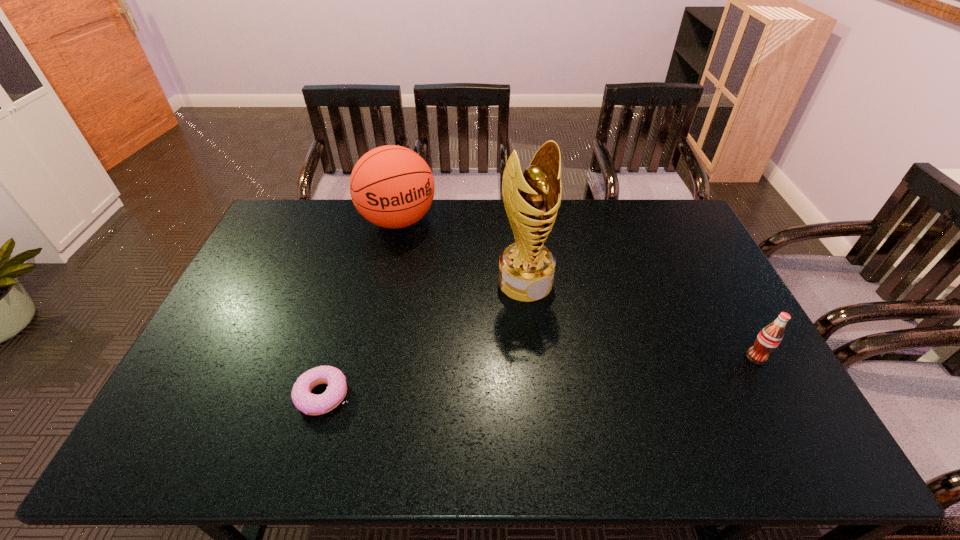
You are a GUI agent. You are given a task and a screenshot of the screen. Output one action in this format:
    pyautogui.click(x=<x>, y=<y>)
    Task: Click on the nearest object
    This screenshot has height=540, width=960.
    Given the screenshot: What is the action you would take?
    pyautogui.click(x=311, y=404)

This screenshot has height=540, width=960. I want to click on the shortest object, so click(311, 404).

Identify the location of the second nearest object. This screenshot has width=960, height=540. (769, 338).

The width and height of the screenshot is (960, 540). In order to click on soda in this screenshot , I will do `click(769, 338)`.

The width and height of the screenshot is (960, 540). What are the coordinates of `the third nearest object` in the screenshot? It's located at (526, 268).

Image resolution: width=960 pixels, height=540 pixels. In order to click on the second object from right to left in this screenshot , I will do `click(526, 268)`.

Find the location of `basketball`. basketball is located at coordinates (391, 186).

Where is `the farthest object`? The image size is (960, 540). the farthest object is located at coordinates (391, 186).

Where is `vacant region located on the back of the nearest object`? This screenshot has height=540, width=960. vacant region located on the back of the nearest object is located at coordinates (342, 330).

Locate an element on the screen. The image size is (960, 540). free space located on the back of the soda is located at coordinates (720, 292).